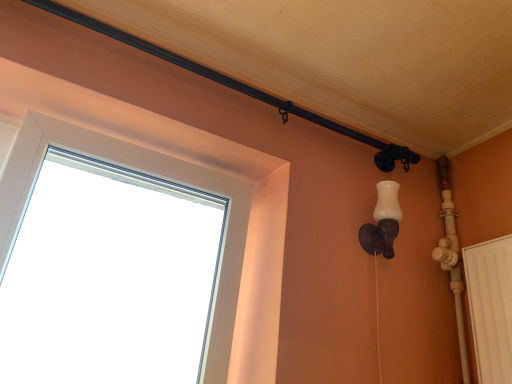
Question: From a real-world perspective, is white matte wall sconce at right physically located above or below white plastic window at upper left?

Choices:
 (A) below
 (B) above

Answer: (B)

Question: Considering the positions of white matte wall sconce at right and white plastic window at upper left in the image, is white matte wall sconce at right taller or shorter than white plastic window at upper left?

Choices:
 (A) short
 (B) tall

Answer: (A)

Question: Is point (379, 198) closer or farther from the camera than point (161, 177)?

Choices:
 (A) farther
 (B) closer

Answer: (A)

Question: Based on their sizes in the image, would you say white plastic window at upper left is bigger or smaller than white matte wall sconce at right?

Choices:
 (A) small
 (B) big

Answer: (B)

Question: In the image, is white plastic window at upper left on the left side or the right side of white matte wall sconce at right?

Choices:
 (A) left
 (B) right

Answer: (A)

Question: Do you think white plastic window at upper left is within white matte wall sconce at right, or outside of it?

Choices:
 (A) inside
 (B) outside

Answer: (B)

Question: Is point (246, 192) positioned closer to the camera than point (374, 244)?

Choices:
 (A) farther
 (B) closer

Answer: (A)